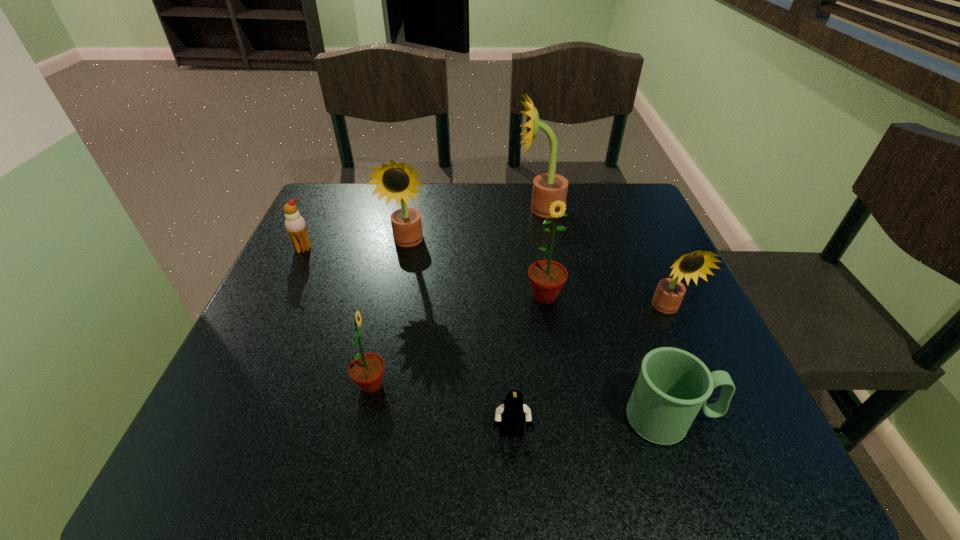
Where is `the tallest object`? The width and height of the screenshot is (960, 540). the tallest object is located at coordinates pyautogui.click(x=547, y=187).

The image size is (960, 540). I want to click on the biggest yellow sunflower, so click(x=547, y=187).

Where is `the bigger green sunflower`? the bigger green sunflower is located at coordinates [x=547, y=277].

Where is `the farther green sunflower`? This screenshot has height=540, width=960. the farther green sunflower is located at coordinates (547, 277).

At what (x,y) coordinates should I click in order to perform the action: click on the leftmost yellow sunflower. Please return your answer as a coordinate pair (x, y). Looking at the image, I should click on (397, 181).

At what (x,y) coordinates should I click in order to perform the action: click on the second smallest yellow sunflower. Please return your answer as a coordinate pair (x, y). The height and width of the screenshot is (540, 960). Looking at the image, I should click on (397, 181).

Locate an element on the screen. The width and height of the screenshot is (960, 540). the left green sunflower is located at coordinates (366, 370).

At what (x,y) coordinates should I click in order to perform the action: click on the smaller green sunflower. Please return your answer as a coordinate pair (x, y). This screenshot has width=960, height=540. Looking at the image, I should click on (366, 370).

This screenshot has height=540, width=960. Identify the location of the smallest yellow sunflower. click(x=669, y=293).

Find the location of a particular element. This screenshot has width=960, height=540. the rightmost sunflower is located at coordinates (669, 293).